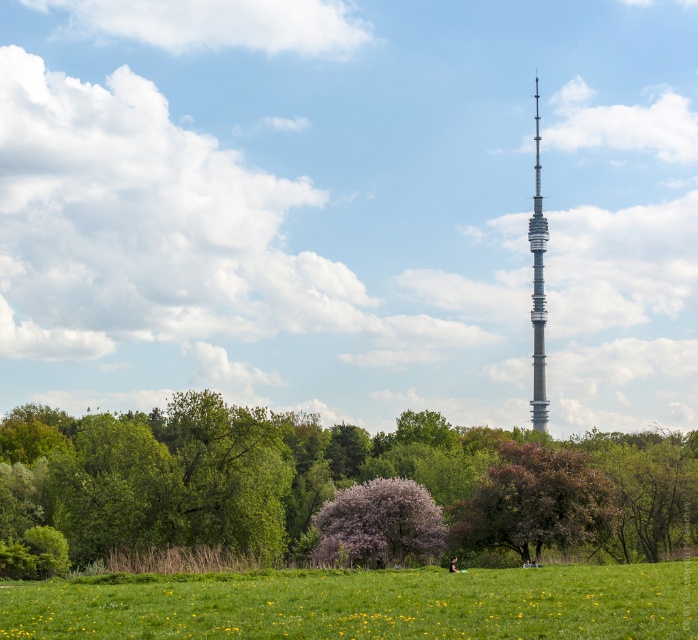
Question: Which point is farther to the camera?

Choices:
 (A) (542, 387)
 (B) (533, 396)
 (C) (540, 544)

Answer: (B)

Question: Is pink blossoming tree at center below gray metallic tower at center?

Choices:
 (A) no
 (B) yes

Answer: (B)

Question: Which object is the closest to the green grass at lower center?

Choices:
 (A) pink blossoming tree at center
 (B) green leafy tree at center

Answer: (A)

Question: Does green grass at lower center lie in front of silver metallic tower at center?

Choices:
 (A) no
 (B) yes

Answer: (B)

Question: Among these objects, which one is farthest from the camera?

Choices:
 (A) purple-blooming tree at center
 (B) green grass at lower center
 (C) pink blossoming tree at center
 (D) gray metallic tower at center

Answer: (D)

Question: Can you confirm if pink blossoming tree at center is positioned to the left of gray metallic tower at center?

Choices:
 (A) yes
 (B) no

Answer: (A)